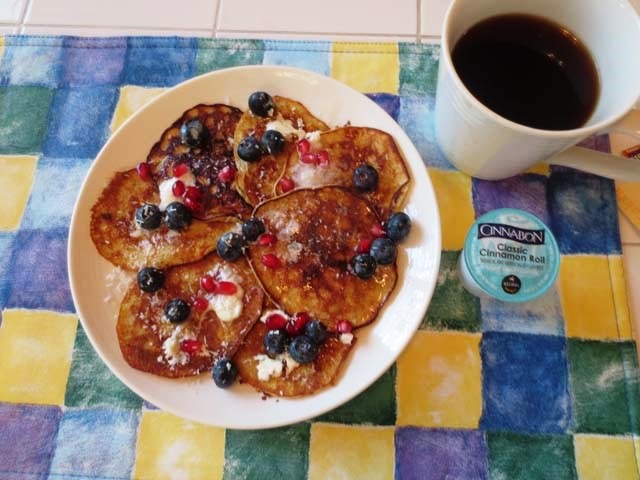
Image resolution: width=640 pixels, height=480 pixels. Identify the location of top edge of place mat. (253, 38).